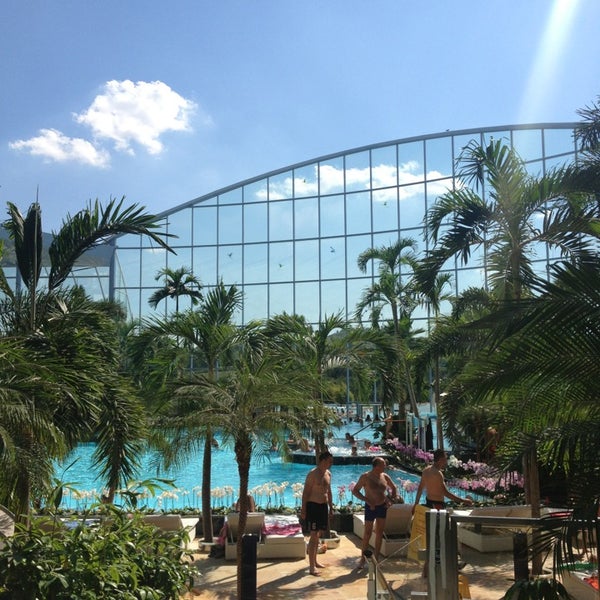
The width and height of the screenshot is (600, 600). I want to click on chair, so click(x=278, y=526), click(x=255, y=518), click(x=168, y=520), click(x=397, y=518), click(x=512, y=511).